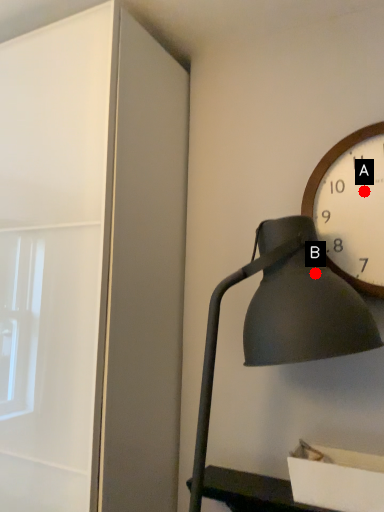
Question: Two points are circled on the image, labeled by A and B beside each circle. Which point appears closest to the camera in this image?

Choices:
 (A) A is closer
 (B) B is closer

Answer: (B)